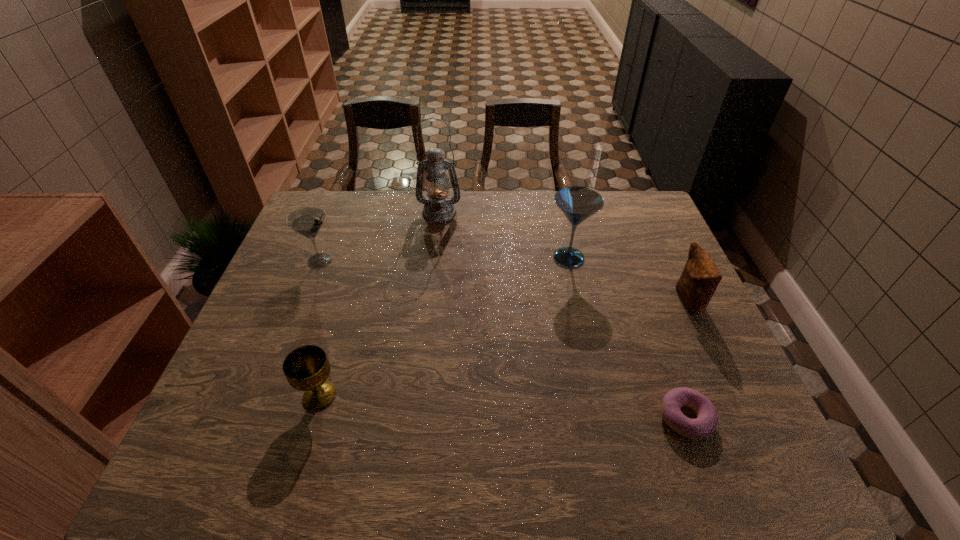
Where is `the fifth object from left to right`? the fifth object from left to right is located at coordinates (703, 426).

Image resolution: width=960 pixels, height=540 pixels. Find the location of `free region located on the left of the tallest object`. free region located on the left of the tallest object is located at coordinates (347, 212).

Locate an element on the screen. This screenshot has height=540, width=960. vacant space situated on the back of the right martini is located at coordinates (563, 232).

Locate an element on the screen. The width and height of the screenshot is (960, 540). free space located on the right of the left martini is located at coordinates (362, 261).

Identify the location of free spot located on the open side of the fourth farthest object. (580, 301).

Where is `vacant area located on the open side of the fourth farthest object`? vacant area located on the open side of the fourth farthest object is located at coordinates (624, 301).

This screenshot has width=960, height=540. What are the coordinates of `free space located on the open side of the fourth farthest object` in the screenshot? It's located at (591, 301).

The image size is (960, 540). I want to click on free space located 0.210m on the right of the chalice, so click(433, 396).

At what (x,y) coordinates should I click in order to perform the action: click on vacant area situated 0.220m on the back of the fifth object from left to right. Please return your answer as a coordinate pair (x, y). The image size is (960, 540). Looking at the image, I should click on (650, 320).

This screenshot has width=960, height=540. Find the location of `object that is positioned at the far edge`. object that is positioned at the far edge is located at coordinates (438, 208).